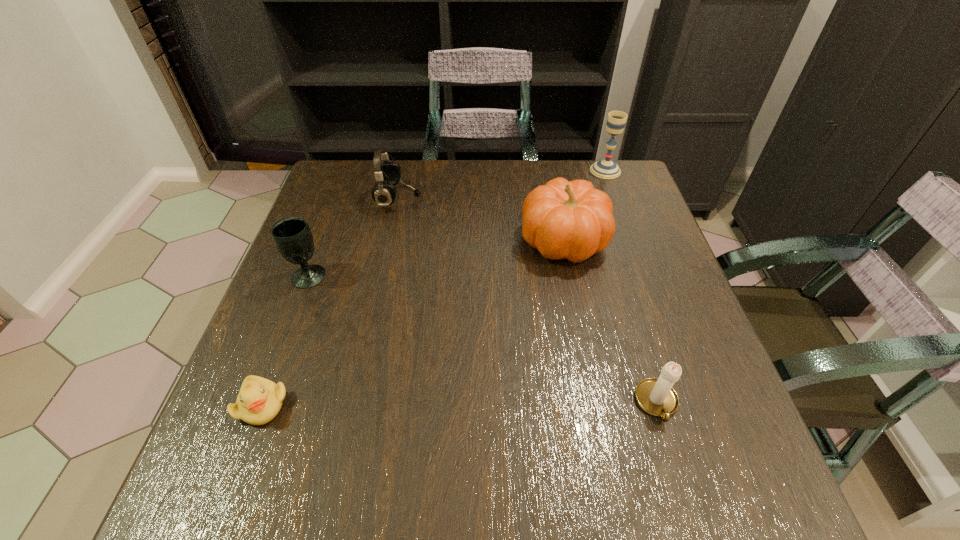
Locate an element on the screen. This screenshot has width=960, height=540. the farther chalice is located at coordinates (607, 169).

At what (x,y) coordinates should I click in order to perform the action: click on the farthest object. Please return your answer as a coordinate pair (x, y). The width and height of the screenshot is (960, 540). Looking at the image, I should click on (607, 169).

What are the coordinates of `pumpkin` in the screenshot? It's located at (572, 220).

The image size is (960, 540). In order to click on headset in this screenshot , I will do `click(387, 174)`.

Identify the location of the left chalice. (292, 236).

Where is `the shorter chalice`? Image resolution: width=960 pixels, height=540 pixels. the shorter chalice is located at coordinates (292, 236).

Locate an element on the screen. candle holder is located at coordinates (655, 396).

Locate an element on the screen. duckling is located at coordinates (259, 400).

Locate an element on the screen. The height and width of the screenshot is (540, 960). vacant space located on the left of the farthest object is located at coordinates (534, 171).

Where is `vacant space located on the left of the pumpkin`? This screenshot has height=540, width=960. vacant space located on the left of the pumpkin is located at coordinates [408, 240].